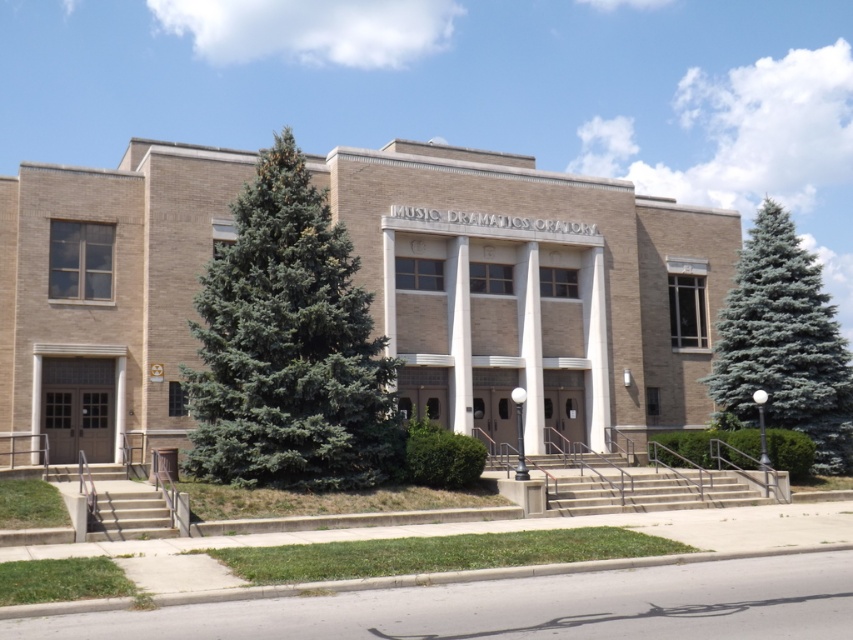
You are standing at the entrance of the building and want to walk to the point labeled as point (780, 282). However, there is an obstacle at point (200, 424). Will you encounter this obstacle on your way?

Yes, you will encounter the obstacle at point (200, 424) because it is in front of point (780, 282), meaning the obstacle lies along the path towards your destination.